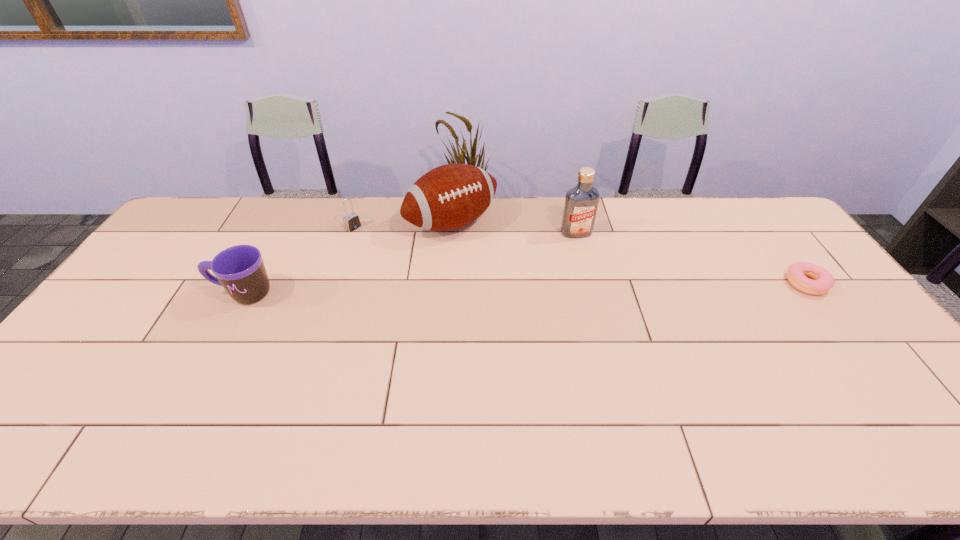
The width and height of the screenshot is (960, 540). I want to click on vodka that is at the far edge, so click(x=581, y=203).

At what (x,y) coordinates should I click in order to perform the action: click on padlock situated at the far edge. Please return your answer as a coordinate pair (x, y). Looking at the image, I should click on (351, 221).

Locate an element on the screen. The image size is (960, 540). object present at the right edge is located at coordinates point(823,281).

You are a GUI agent. You are given a task and a screenshot of the screen. Output one action in this format:
    pyautogui.click(x=<x>, y=<y>)
    Task: Click on the vacant space at the far edge of the desktop
    Image resolution: width=960 pixels, height=540 pixels.
    Given the screenshot: What is the action you would take?
    pyautogui.click(x=287, y=204)

The image size is (960, 540). Find the location of `vacant space at the near edge of the desktop`. vacant space at the near edge of the desktop is located at coordinates (805, 381).

In the image, there is a desktop. Identify the location of vacant space at the left edge. The width and height of the screenshot is (960, 540). (151, 333).

Find the location of a particular element. Image resolution: width=960 pixels, height=540 pixels. free space at the right edge is located at coordinates (834, 324).

You are a GUI agent. You are given a task and a screenshot of the screen. Output one action in this format:
    pyautogui.click(x=<x>, y=<y>)
    Task: Click on the vacant space at the near left corner of the desktop
    The height and width of the screenshot is (540, 960).
    Given the screenshot: What is the action you would take?
    pyautogui.click(x=91, y=404)

Where is `free point at the far right corner`? This screenshot has width=960, height=540. free point at the far right corner is located at coordinates (737, 213).

Identify the location of vacant point located between the mug and the football. (348, 259).